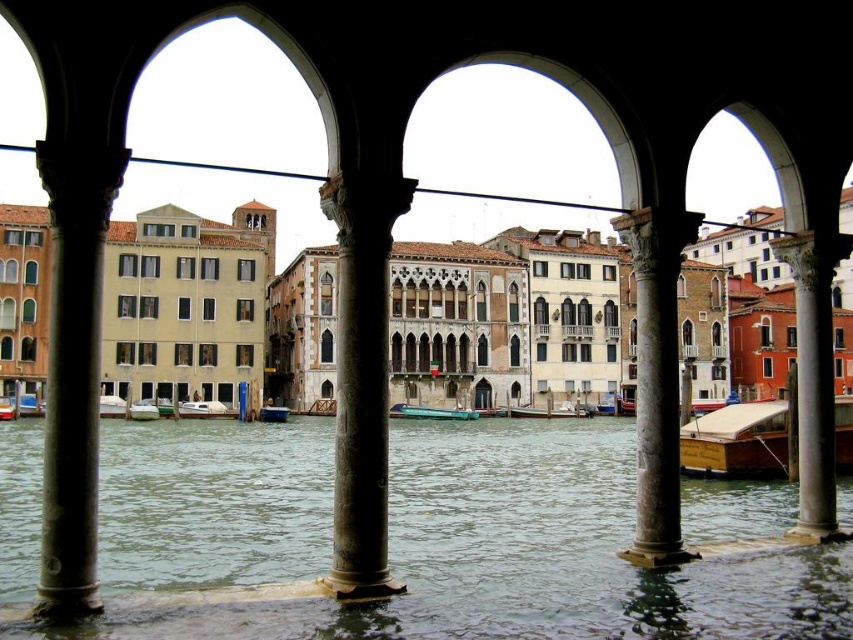
Question: Which of the following is the farthest from the observer?

Choices:
 (A) (816, 589)
 (B) (271, 408)
 (C) (409, 413)

Answer: (C)

Question: Which of the following is the farthest from the observer?

Choices:
 (A) (9, 424)
 (B) (143, 410)

Answer: (B)

Question: Can you confirm if clear water at center is wider than wooden polished boat at center?

Choices:
 (A) no
 (B) yes

Answer: (B)

Question: Which of the following is the farthest from the observer?

Choices:
 (A) green matte boat at center
 (B) white wooden boat at center
 (C) wooden polished boat at right
 (D) metallic blue boat at center

Answer: (A)

Question: Can you confirm if wooden polished boat at right is positioned below metallic blue boat at center?

Choices:
 (A) yes
 (B) no

Answer: (A)

Question: Can you confirm if wooden polished boat at right is smaller than green matte boat at center?

Choices:
 (A) no
 (B) yes

Answer: (A)